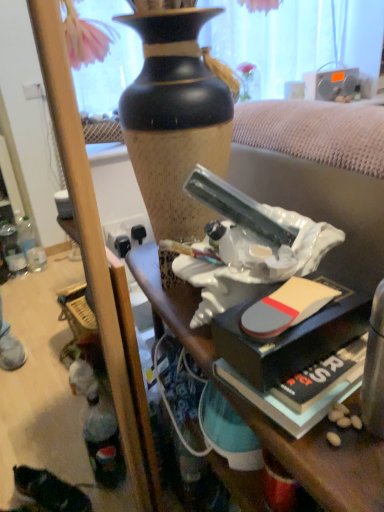
Question: Considering the relative sizes of hardcover book at lower right and white glossy statue at center in the image provided, is hardcover book at lower right smaller than white glossy statue at center?

Choices:
 (A) no
 (B) yes

Answer: (B)

Question: Does hardcover book at lower right come in front of white glossy statue at center?

Choices:
 (A) no
 (B) yes

Answer: (A)

Question: Is hardcover book at lower right in contact with white glossy statue at center?

Choices:
 (A) yes
 (B) no

Answer: (B)

Question: From a real-world perspective, is hardcover book at lower right over white glossy statue at center?

Choices:
 (A) no
 (B) yes

Answer: (B)

Question: Is hardcover book at lower right located outside white glossy statue at center?

Choices:
 (A) yes
 (B) no

Answer: (A)

Question: From a real-world perspective, is silver metallic radio at upper right positioned above or below hardcover book at lower right?

Choices:
 (A) above
 (B) below

Answer: (A)

Question: Considering the positions of silver metallic radio at upper right and hardcover book at lower right in the image, is silver metallic radio at upper right wider or thinner than hardcover book at lower right?

Choices:
 (A) wide
 (B) thin

Answer: (B)

Question: Considering the relative positions of silver metallic radio at upper right and hardcover book at lower right in the image provided, is silver metallic radio at upper right to the left or to the right of hardcover book at lower right?

Choices:
 (A) right
 (B) left

Answer: (A)

Question: Is silver metallic radio at upper right taller or shorter than hardcover book at lower right?

Choices:
 (A) short
 (B) tall

Answer: (B)

Question: Based on their sizes in the image, would you say white glossy statue at center is bigger or smaller than silver metallic radio at upper right?

Choices:
 (A) small
 (B) big

Answer: (B)

Question: From their relative heights in the image, would you say white glossy statue at center is taller or shorter than silver metallic radio at upper right?

Choices:
 (A) short
 (B) tall

Answer: (B)

Question: Considering their positions, is white glossy statue at center located in front of or behind silver metallic radio at upper right?

Choices:
 (A) front
 (B) behind

Answer: (A)

Question: Looking at their shapes, would you say white glossy statue at center is wider or thinner than silver metallic radio at upper right?

Choices:
 (A) wide
 (B) thin

Answer: (A)

Question: In the image, is hardcover book at lower right positioned in front of or behind silver metallic radio at upper right?

Choices:
 (A) behind
 (B) front

Answer: (B)

Question: Considering the positions of hardcover book at lower right and silver metallic radio at upper right in the image, is hardcover book at lower right bigger or smaller than silver metallic radio at upper right?

Choices:
 (A) big
 (B) small

Answer: (B)